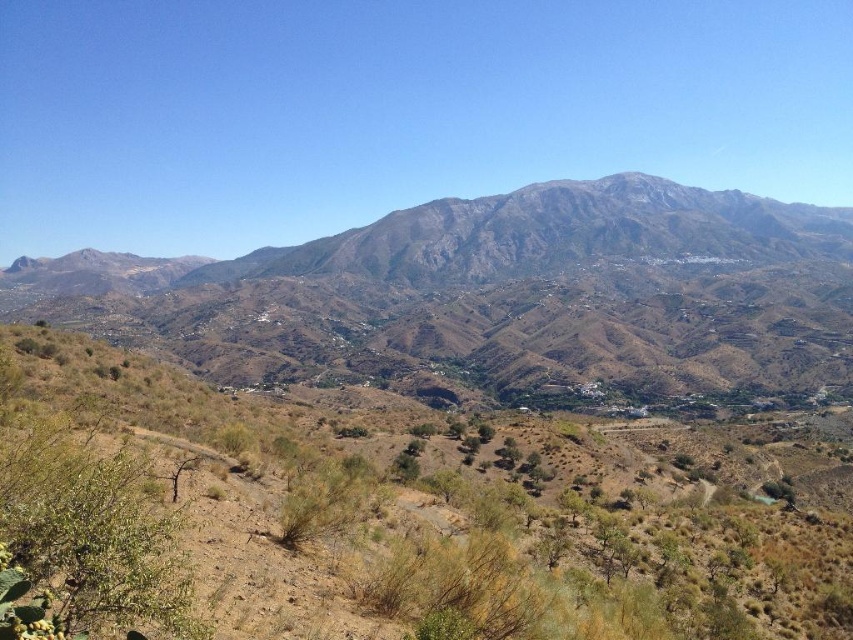
Which of these two, dry shrubbery at center or rugged brown mountain range at center, stands shorter?

Standing shorter between the two is dry shrubbery at center.

This screenshot has height=640, width=853. What are the coordinates of `dry shrubbery at center` in the screenshot? It's located at (398, 520).

Locate an element on the screen. The height and width of the screenshot is (640, 853). dry shrubbery at center is located at coordinates (398, 520).

Identify the location of dry shrubbery at center. This screenshot has width=853, height=640. (398, 520).